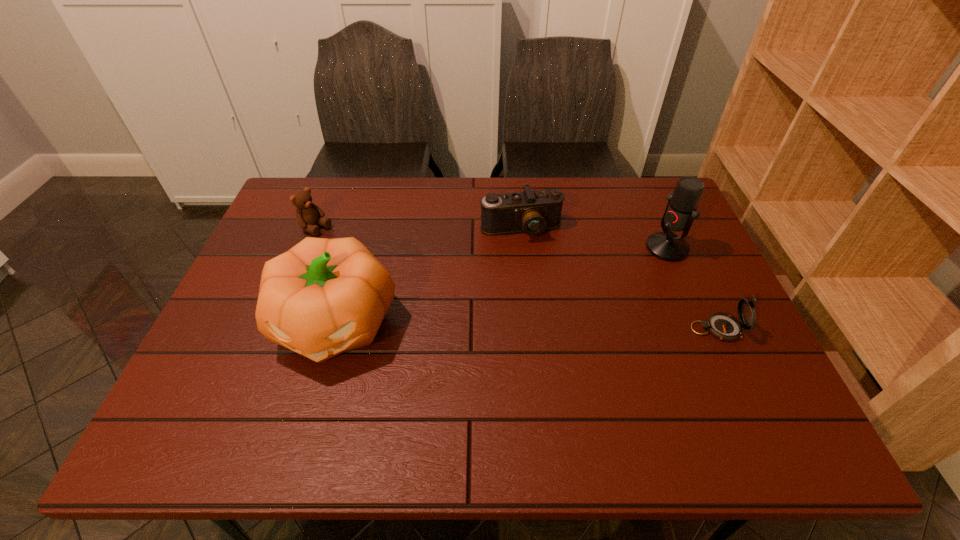
The height and width of the screenshot is (540, 960). Find the location of `free region located 0.250m on the lens of the third object from left to right`. free region located 0.250m on the lens of the third object from left to right is located at coordinates (552, 308).

This screenshot has height=540, width=960. I want to click on free space located 0.060m on the face of the teddy bear, so click(341, 242).

This screenshot has width=960, height=540. Find the location of `vacant space located 0.340m on the face of the teddy bear`. vacant space located 0.340m on the face of the teddy bear is located at coordinates (413, 283).

Where is `vacant space situated 0.300m on the face of the teddy bear`? The image size is (960, 540). vacant space situated 0.300m on the face of the teddy bear is located at coordinates (402, 277).

At what (x,y) coordinates should I click in order to perform the action: click on camera located in the far edge section of the desktop. Please return your answer as a coordinate pair (x, y). The height and width of the screenshot is (540, 960). Looking at the image, I should click on tap(532, 212).

You are a GUI agent. You are given a task and a screenshot of the screen. Output one action in this format:
    pyautogui.click(x=<x>, y=<y>)
    Task: Click on the teddy bear located at the far edge
    
    Given the screenshot: What is the action you would take?
    pyautogui.click(x=308, y=214)

Where is `object that is at the near edge`? This screenshot has height=540, width=960. object that is at the near edge is located at coordinates (323, 297).

Locate an element on the screen. The height and width of the screenshot is (540, 960). pumpkin present at the left edge is located at coordinates (323, 297).

Where is `teddy bear located in the left edge section of the desktop`? teddy bear located in the left edge section of the desktop is located at coordinates (308, 214).

This screenshot has width=960, height=540. Identify the location of compass located at the right edge. (725, 327).